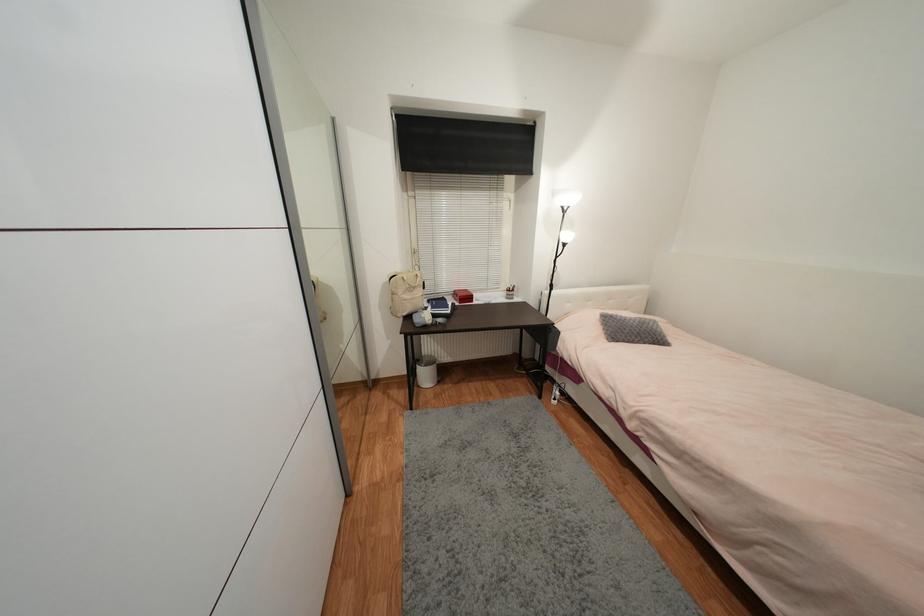
You are a GUI agent. You are given a task and a screenshot of the screen. Output one action in this format:
    pyautogui.click(x=<x>, y=<y>)
    Task: Click on the grey bottle
    This screenshot has height=616, width=924.
    Given the screenshot: What is the action you would take?
    pyautogui.click(x=554, y=392)